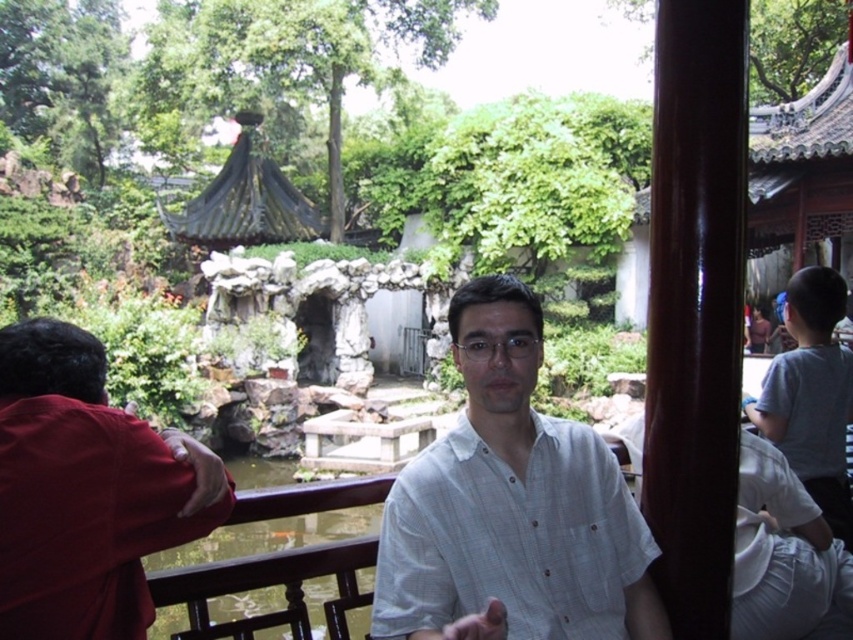
Question: Is white textured shirt at center wider than dark gray stone gazebo at upper left?

Choices:
 (A) yes
 (B) no

Answer: (B)

Question: Which of these objects is positioned closest to the transparent glass pond at center?

Choices:
 (A) red matte shirt at left
 (B) gray cotton shirt at right
 (C) dark gray stone gazebo at upper left
 (D) white textured shirt at center

Answer: (A)

Question: Estimate the real-world distances between objects in this image. Which object is closer to the white textured shirt at center?

Choices:
 (A) dark gray stone gazebo at upper left
 (B) red matte shirt at left
 (C) gray cotton shirt at right
 (D) transparent glass pond at center

Answer: (D)

Question: Considering the real-world distances, which object is farthest from the red matte shirt at left?

Choices:
 (A) dark gray stone gazebo at upper left
 (B) transparent glass pond at center
 (C) white textured shirt at center

Answer: (A)

Question: Can you confirm if transparent glass pond at center is wider than dark gray stone gazebo at upper left?

Choices:
 (A) yes
 (B) no

Answer: (B)

Question: Does red matte shirt at left have a lesser width compared to dark gray stone gazebo at upper left?

Choices:
 (A) yes
 (B) no

Answer: (A)